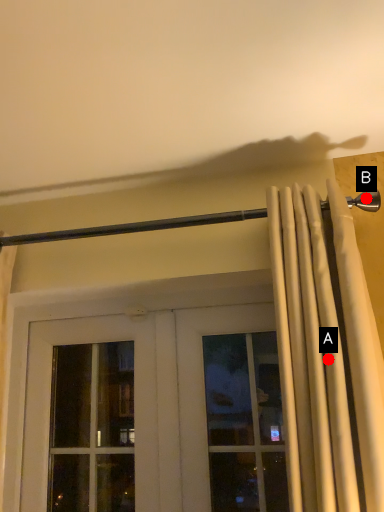
Question: Two points are circled on the image, labeled by A and B beside each circle. Which point appears closest to the camera in this image?

Choices:
 (A) A is closer
 (B) B is closer

Answer: (A)